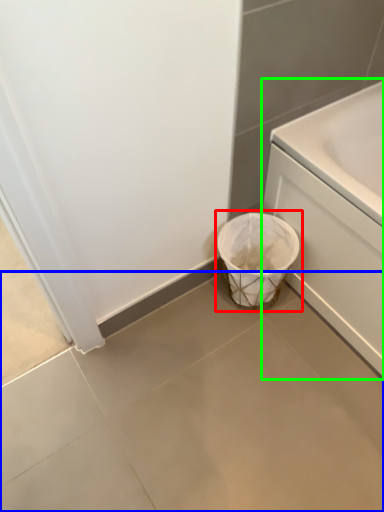
Question: Considering the real-world distances, which object is farthest from waste container (highlighted by a red box)? concrete (highlighted by a blue box) or bath (highlighted by a green box)?

Choices:
 (A) concrete
 (B) bath

Answer: (A)